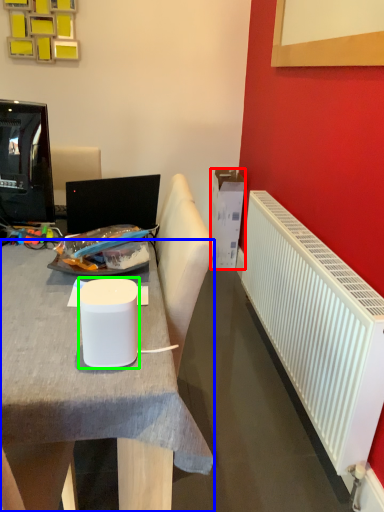
Question: Estimate the real-world distances between objects in this image. Which object is farther from box (highlighted by a red box), desk (highlighted by a blue box) or paper cup (highlighted by a green box)?

Choices:
 (A) desk
 (B) paper cup

Answer: (B)